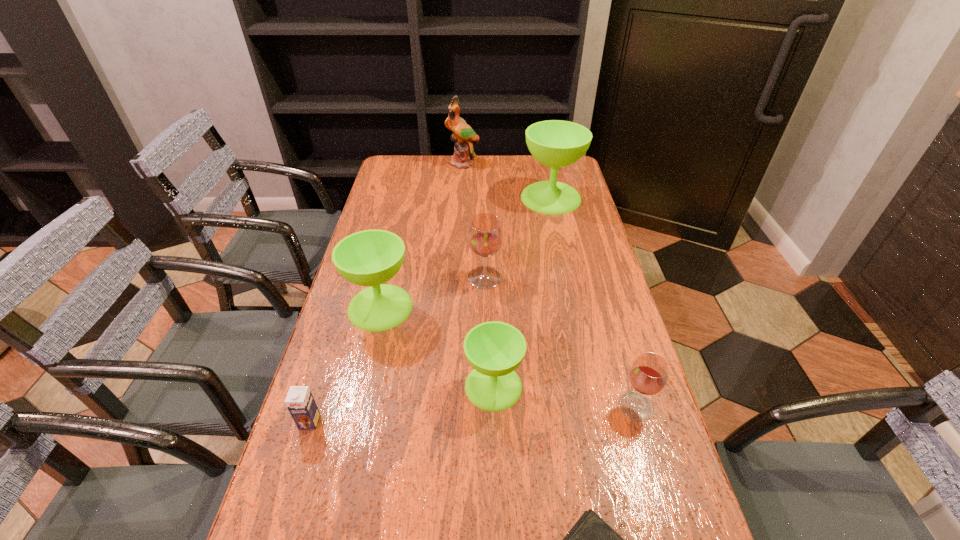
I want to click on the farthest object, so click(463, 135).

The height and width of the screenshot is (540, 960). In order to click on green parrot in this screenshot , I will do `click(463, 135)`.

Locate an element on the screen. the tallest wineglass is located at coordinates (555, 143).

This screenshot has height=540, width=960. Identify the location of the rightmost green wineglass. (555, 143).

Identify the location of the left red wineglass. tap(485, 235).

Where is `the farther red wineglass`? Image resolution: width=960 pixels, height=540 pixels. the farther red wineglass is located at coordinates (485, 235).

Where is `the leftmost wineglass`? The height and width of the screenshot is (540, 960). the leftmost wineglass is located at coordinates (371, 257).

This screenshot has height=540, width=960. What are the coordinates of `the leftmost green wineglass` in the screenshot? It's located at (371, 257).

The image size is (960, 540). What are the coordinates of `the smallest green wineglass` in the screenshot? It's located at (494, 349).

What are the coordinates of `the nearest green wineglass` in the screenshot? It's located at (494, 349).